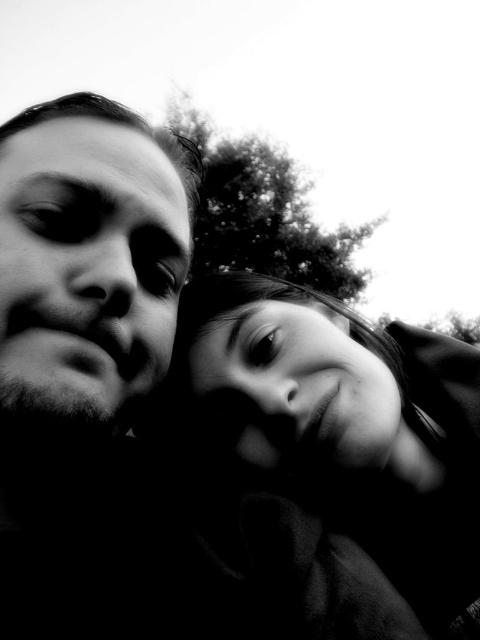
In the scene shown: Based on the scene description, which smooth skin face is more to the right between the smooth skin face at center and the smooth skin face at left?

The smooth skin face at center is more to the right than the smooth skin face at left.

You are a photographer adjusting the focus on a camera. You notice two points in the image, point 1 at coordinates point (x=284, y=492) and point 2 at coordinates point (x=91, y=273). Which point is closer to the camera lens?

Point 1 at coordinates point (x=284, y=492) is closer to the camera lens than point 2 at coordinates point (x=91, y=273) because it is further to the viewer.